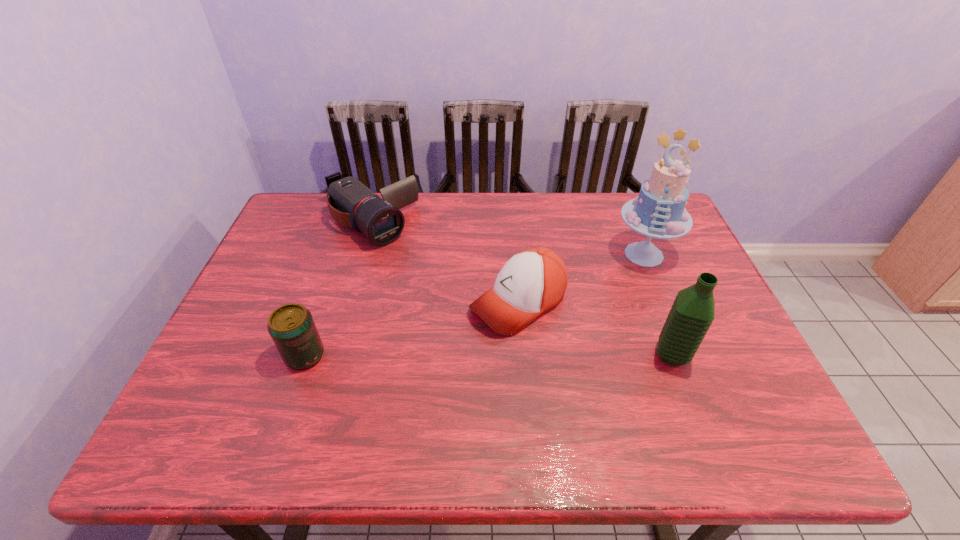
Locate an element on the screen. The width and height of the screenshot is (960, 540). cake that is at the right edge is located at coordinates (659, 212).

The image size is (960, 540). I want to click on object that is at the far left corner, so click(351, 203).

Identify the location of object that is at the far right corner. (659, 212).

Locate an element on the screen. vacant space at the far edge is located at coordinates (574, 228).

The width and height of the screenshot is (960, 540). I want to click on free spot at the near edge of the desktop, so click(389, 408).

You are a GUI agent. You are given a task and a screenshot of the screen. Output one action in this format:
    pyautogui.click(x=<x>, y=<y>)
    Task: Click on the vacant space at the right edge
    Image resolution: width=960 pixels, height=540 pixels.
    Given the screenshot: What is the action you would take?
    pyautogui.click(x=677, y=269)

You are a GUI agent. You are given a task and a screenshot of the screen. Output one action in this format:
    pyautogui.click(x=<x>, y=<y>)
    Task: Click on the free space at the far left corner of the desktop
    This screenshot has width=960, height=540.
    Given the screenshot: What is the action you would take?
    coord(300,195)

At what (x,y) coordinates should I click in order to perform the action: click on free space that is in between the third object from left to right and the beer can. Please return your answer as a coordinate pair (x, y). The width and height of the screenshot is (960, 540). Looking at the image, I should click on (412, 329).

Where is `free spot between the third object from right to left and the camcorder`? The image size is (960, 540). free spot between the third object from right to left and the camcorder is located at coordinates (444, 263).

You are a GUI agent. You are given a task and a screenshot of the screen. Output one action in this format:
    pyautogui.click(x=<x>, y=<y>)
    Task: Click on the vacant area between the second tallest object and the third object from right to left
    
    Given the screenshot: What is the action you would take?
    pyautogui.click(x=595, y=329)